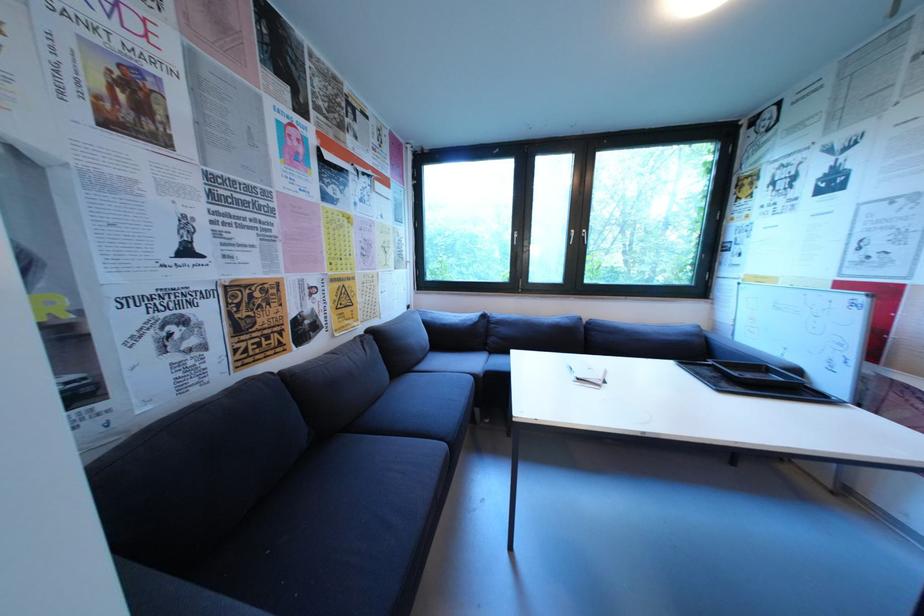
Which object does [755,381] point to?

It corresponds to the black plastic tray in the image.